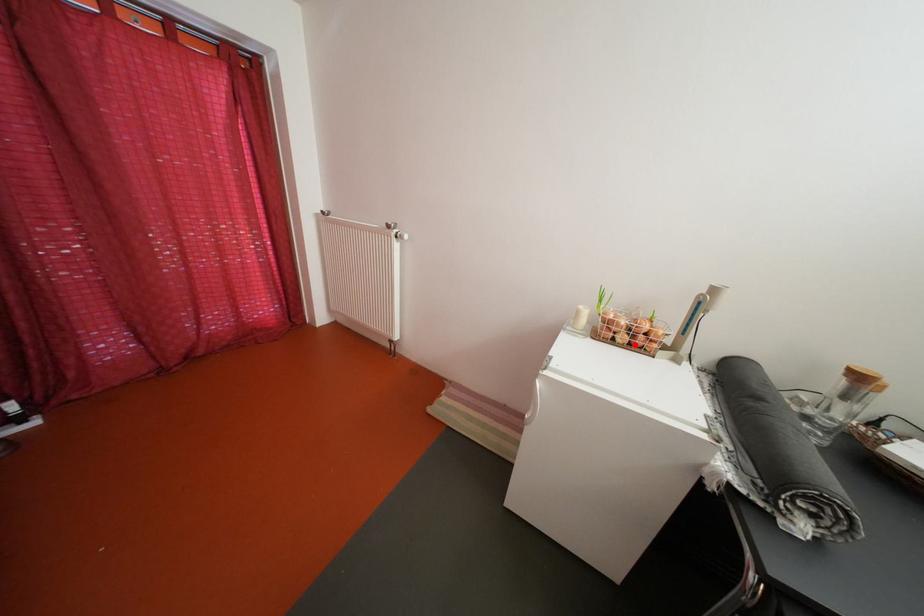
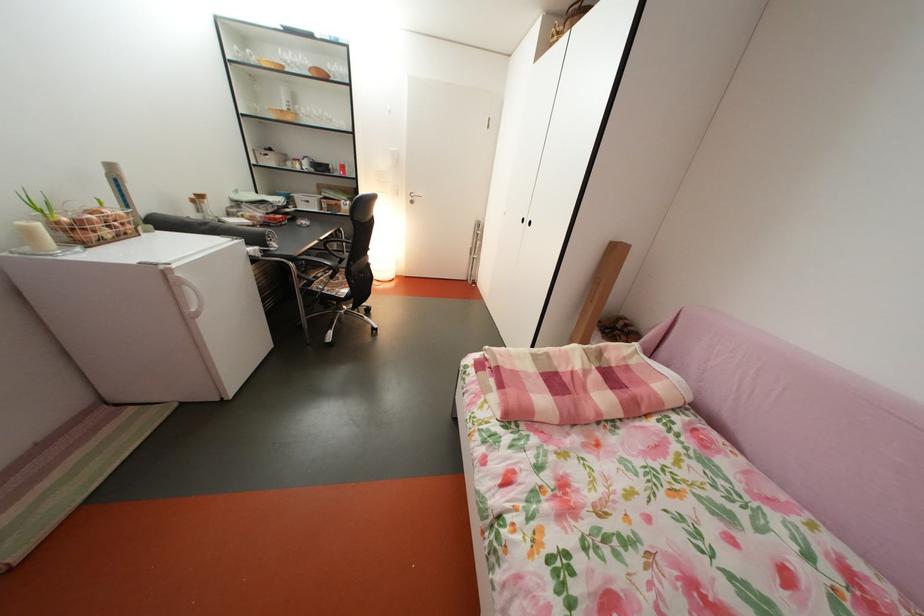
Question: I am providing you with two images of the same scene from different viewpoints. A red point is marked on the first image. Is the red point's position out of view in image 2?

Choices:
 (A) Yes
 (B) No

Answer: (B)